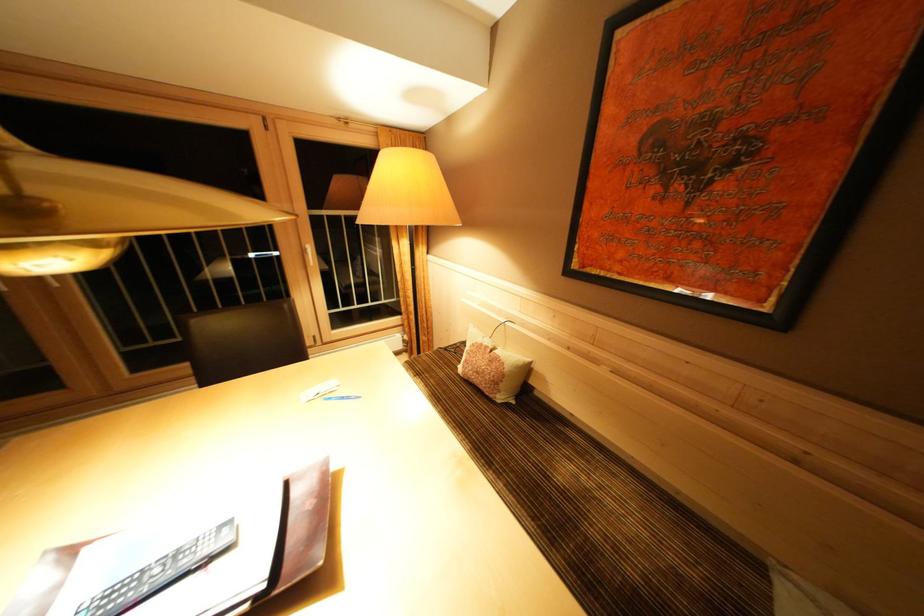
Which object does [492,367] point to?

It corresponds to the small decorative pillow in the image.